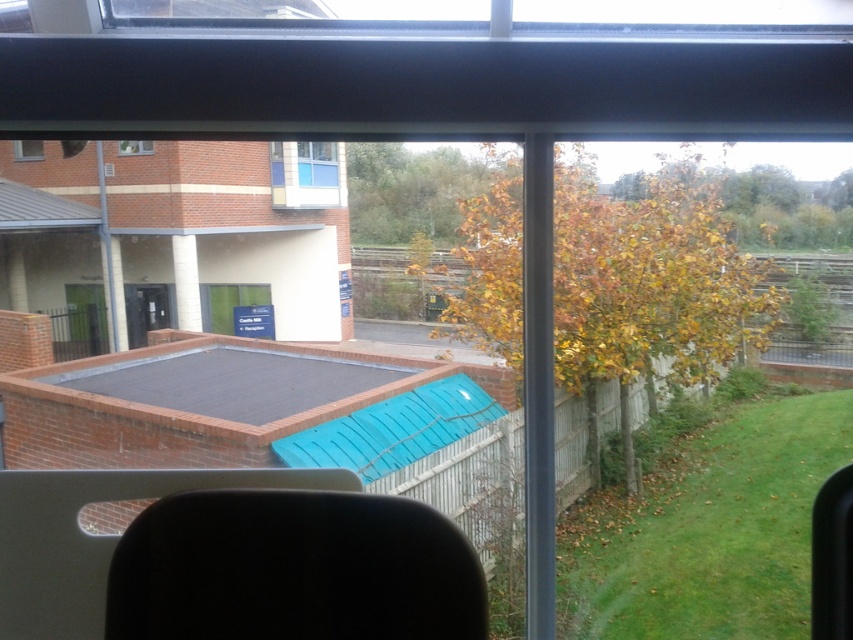
You are standing inside a room and want to look outside through the clear glass window at upper left and the clear glass window at upper center. Which window allows you to see more of the brick wall with the flat roofed structure?

The clear glass window at upper left allows you to see more of the brick wall with the flat roofed structure because it is in front of the clear glass window at upper center.

You are standing at the window inside the building and want to know how far the point at coordinates point (33, 141) is from you. Can you determine the distance?

The point (33, 141) is 11.51 meters away from the camera, so the distance is 11.51 meters.

You are standing at the window inside the building and see two points marked in the scene. Which point is closer to you, the one at coordinates point (337,188) or point (141,152)?

Point (337,188) is further to the viewer than point (141,152), so the closer point to you is point (141,152).